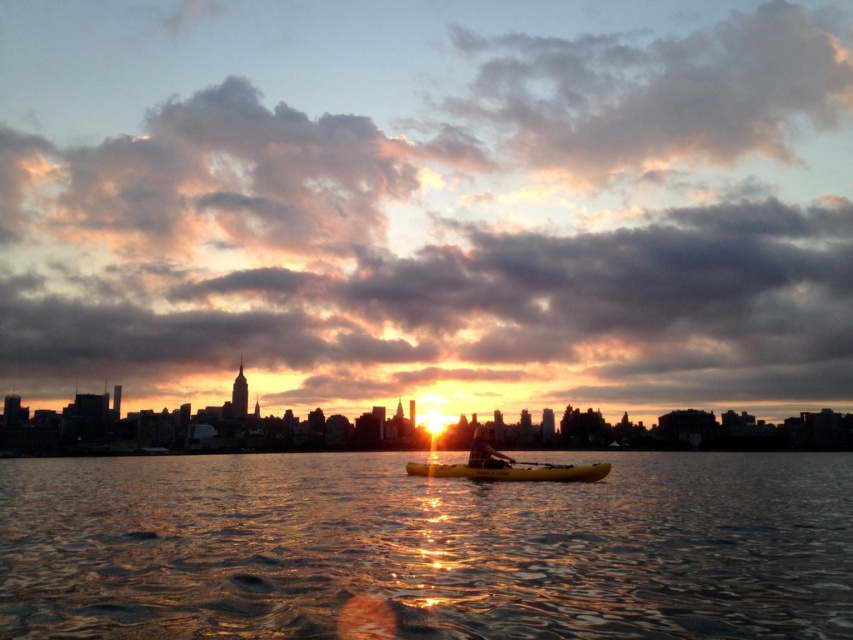
You are standing on the shore and want to throw a pebble to the glistening water at center. If your throwing distance is 150 meters, will you be able to reach it?

The glistening water at center is 154.16 meters away from the viewer. Since your throwing distance is 150 meters, you cannot reach it.

Looking at this image, you are a photographer trying to capture the sunset reflection on the water. You notice a point at coordinates point (425, 548). What object is located at that point?

The point (425, 548) has glistening water at center.